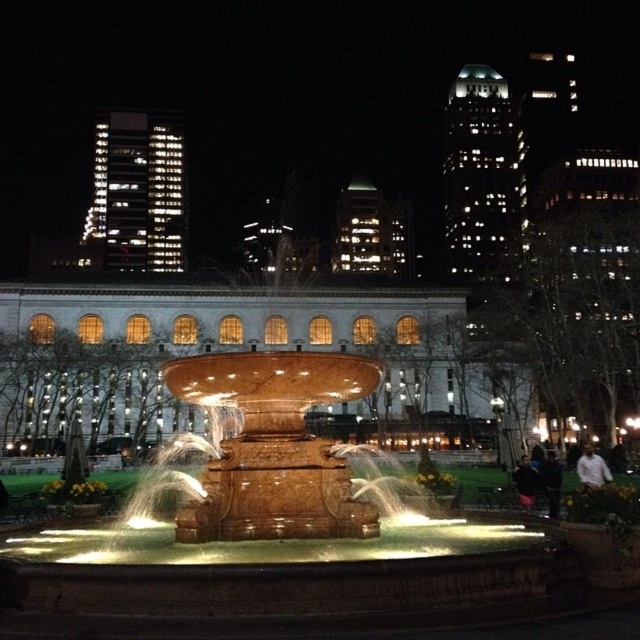
Question: Can you confirm if white cotton shirt at lower right is positioned below dark blue fabric jacket at lower right?

Choices:
 (A) no
 (B) yes

Answer: (A)

Question: Is dark blue jeans at lower right behind white cotton shirt at lower right?

Choices:
 (A) no
 (B) yes

Answer: (A)

Question: Does white cotton shirt at lower right appear on the right side of dark blue fabric jacket at lower right?

Choices:
 (A) no
 (B) yes

Answer: (B)

Question: Among these objects, which one is nearest to the camera?

Choices:
 (A) dark blue jeans at lower right
 (B) white cotton shirt at lower right
 (C) dark blue fabric jacket at lower right

Answer: (A)

Question: Which of the following is the farthest from the observer?

Choices:
 (A) dark blue jeans at lower right
 (B) white cotton shirt at lower right

Answer: (B)

Question: Based on their relative distances, which object is farther from the dark blue jeans at lower right?

Choices:
 (A) white cotton shirt at lower right
 (B) dark blue fabric jacket at lower right

Answer: (A)